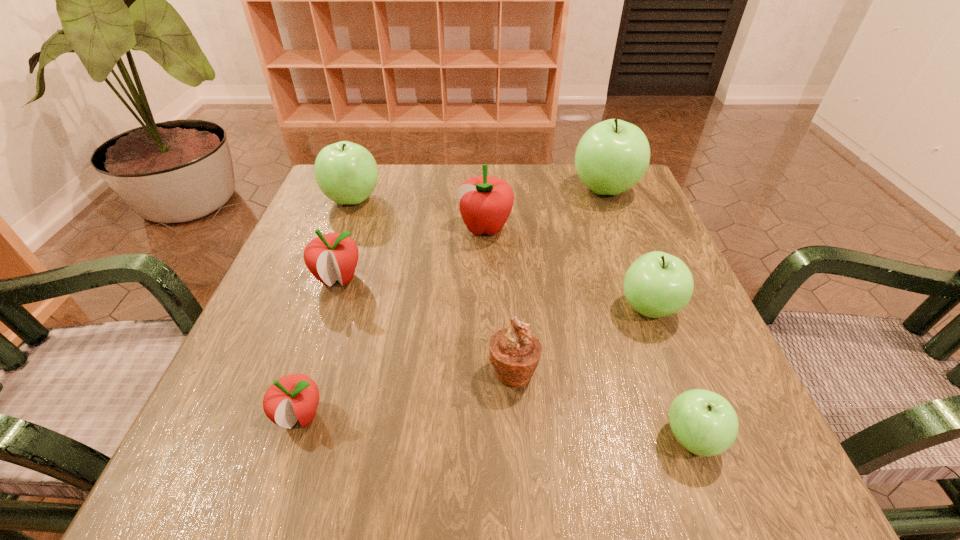
Find the location of a particular element. vacant space located on the front of the tallest apple is located at coordinates (620, 228).

Where is `vacant space situated 0.140m on the right of the farthest red apple`? The width and height of the screenshot is (960, 540). vacant space situated 0.140m on the right of the farthest red apple is located at coordinates (575, 228).

I want to click on vacant space situated on the right of the third smallest green apple, so [x=514, y=199].

I want to click on vacant space located 0.330m on the back of the third biggest green apple, so click(606, 194).

Find the location of a particular element. free region located 0.340m on the front of the second farthest red apple is located at coordinates (271, 478).

You are a GUI agent. You are given a task and a screenshot of the screen. Output one action in this format:
    pyautogui.click(x=<x>, y=<y>)
    Task: Click on the vacant space located on the left of the muffin
    This screenshot has height=540, width=960.
    Given the screenshot: What is the action you would take?
    pyautogui.click(x=320, y=371)

This screenshot has width=960, height=540. I want to click on vacant space located on the back of the smallest red apple, so click(x=344, y=282).

The image size is (960, 540). In order to click on free space located on the back of the nearest green apple in this screenshot , I will do `click(655, 338)`.

This screenshot has width=960, height=540. In order to click on object at the far left corner in this screenshot , I will do `click(347, 173)`.

The height and width of the screenshot is (540, 960). What are the coordinates of `object located at the near left corner` in the screenshot? It's located at (295, 397).